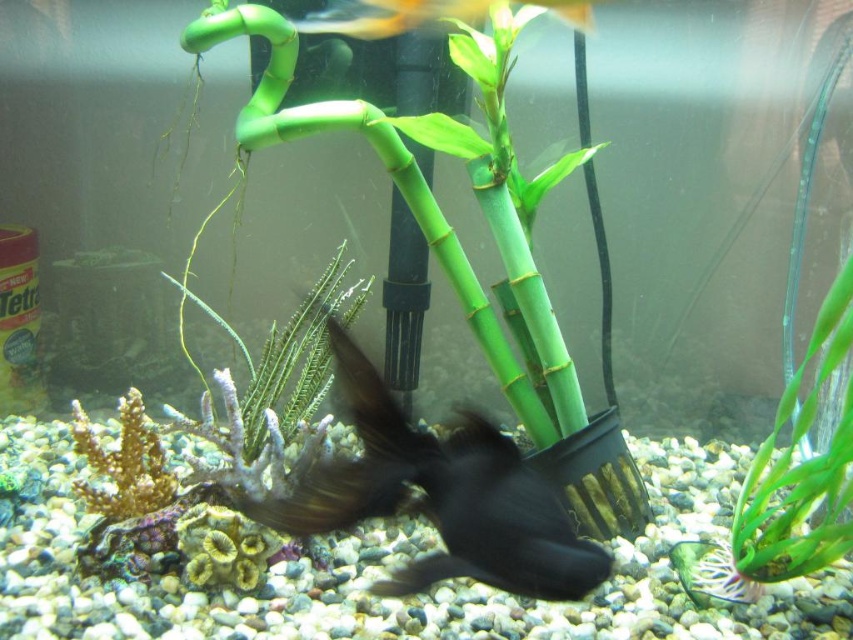
You are a snorkeler exploring the aquarium. You see the green matte plant at center and the translucent yellow fish at upper center. Which one is higher up in the water?

The translucent yellow fish at upper center is higher up in the water because it is positioned above the green matte plant at center.

You are an aquatic plant enthusiast observing the aquarium. You notice the green matte plant at right and the translucent yellow fish at upper center. Which object is located to the right of the other?

The green matte plant at right is positioned on the right side of the translucent yellow fish at upper center, so the green matte plant at right is to the right of the translucent yellow fish at upper center.

You are an underwater explorer in the aquarium. You need to determine if the black matte fish at center can swim over the orange coral at lower left without touching it. Can it?

The black matte fish at center is much taller than the orange coral at lower left, so it can swim over the orange coral at lower left without touching it.